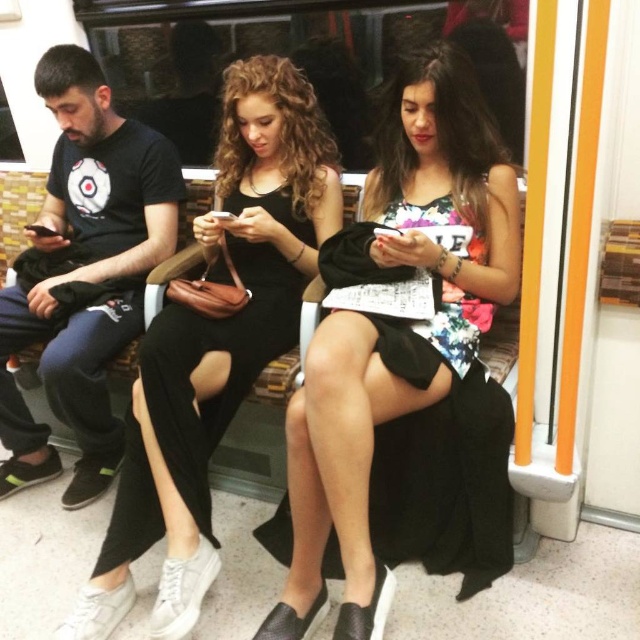
Question: Can you confirm if floral printed dress at center is positioned to the right of black matte t-shirt at left?

Choices:
 (A) no
 (B) yes

Answer: (B)

Question: Estimate the real-world distances between objects in this image. Which object is farther from the black matte dress at center?

Choices:
 (A) black matte t-shirt at left
 (B) floral printed dress at center

Answer: (A)

Question: Estimate the real-world distances between objects in this image. Which object is farther from the black matte t-shirt at left?

Choices:
 (A) floral printed dress at center
 (B) black matte dress at center

Answer: (A)

Question: Which object appears farthest from the camera in this image?

Choices:
 (A) black matte t-shirt at left
 (B) black matte dress at center

Answer: (A)

Question: Where is floral printed dress at center located in relation to black matte t-shirt at left in the image?

Choices:
 (A) below
 (B) above

Answer: (A)

Question: Does black matte t-shirt at left appear under black matte dress at center?

Choices:
 (A) yes
 (B) no

Answer: (B)